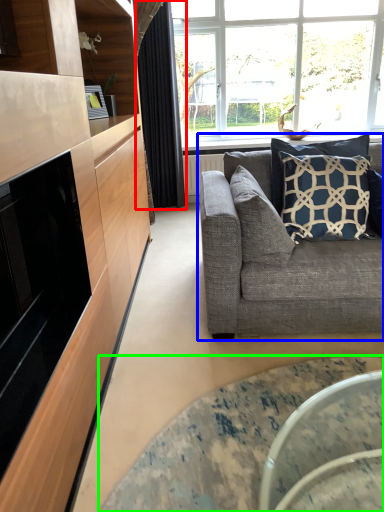
Question: Which object is the closest to the curtain (highlighted by a red box)? Choose among these: studio couch (highlighted by a blue box) or coffee table (highlighted by a green box).

Choices:
 (A) studio couch
 (B) coffee table

Answer: (A)